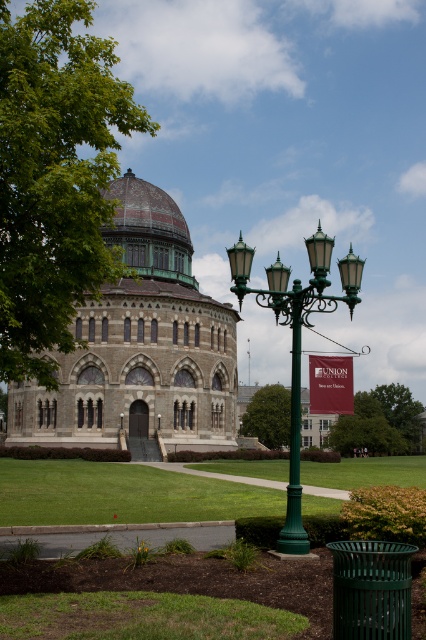
Who is lower down, green leafy tree at lower center or maroon fabric banner at center?

green leafy tree at lower center is lower down.

Is green leafy tree at lower center bigger than maroon fabric banner at center?

Yes, green leafy tree at lower center is bigger than maroon fabric banner at center.

Who is more distant from viewer, (344, 422) or (321, 396)?

Point (344, 422)

At what (x,y) coordinates should I click in order to perform the action: click on green leafy tree at lower center. Please return your answer as a coordinate pair (x, y). The height and width of the screenshot is (640, 426). Looking at the image, I should click on (379, 420).

Does green metal street light at center have a lesser height compared to green metal pole at center?

In fact, green metal street light at center may be taller than green metal pole at center.

Does green metal street light at center appear on the left side of green metal pole at center?

In fact, green metal street light at center is to the right of green metal pole at center.

Measure the distance between green metal street light at center and camera.

green metal street light at center is 119.81 feet from camera.

At what (x,y) coordinates should I click in order to perform the action: click on green metal street light at center. Please return your answer as a coordinate pair (x, y). The image size is (426, 640). Looking at the image, I should click on (296, 340).

Who is more distant from viewer, (293, 284) or (304, 412)?

Positioned behind is point (304, 412).

Which is below, green metal street light at center or green leafy tree at center?

Positioned lower is green leafy tree at center.

Where is `green metal street light at center`? The height and width of the screenshot is (640, 426). green metal street light at center is located at coordinates (296, 340).